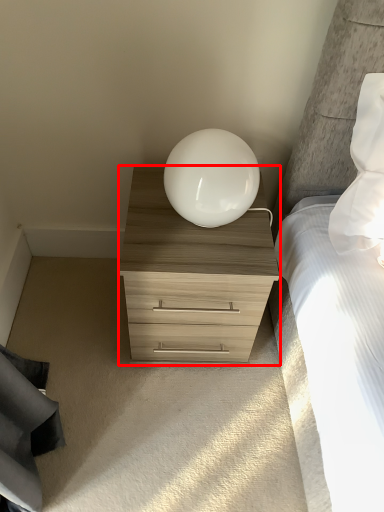
Question: Considering the relative positions of chest of drawers (annotated by the red box) and table lamp in the image provided, where is chest of drawers (annotated by the red box) located with respect to the staircase?

Choices:
 (A) left
 (B) right

Answer: (A)